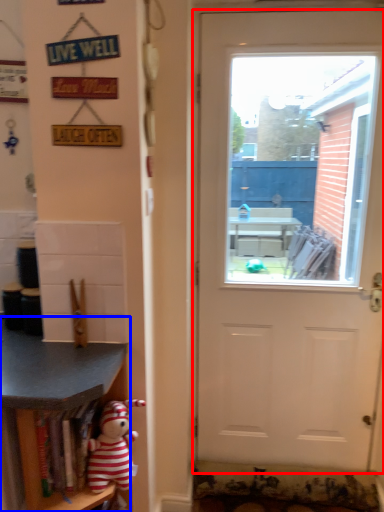
Question: Which of the following is the closest to the observer, door (highlighted by a red box) or shelf (highlighted by a blue box)?

Choices:
 (A) door
 (B) shelf

Answer: (B)